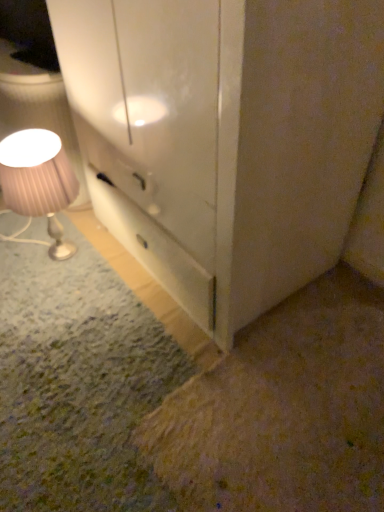
Where is `pink pleated fabric lampshade at left`? This screenshot has height=512, width=384. pink pleated fabric lampshade at left is located at coordinates (38, 181).

What is the approximate height of pink pleated fabric lampshade at left?

pink pleated fabric lampshade at left is 18.29 inches in height.

What do you see at coordinates (38, 181) in the screenshot?
I see `pink pleated fabric lampshade at left` at bounding box center [38, 181].

This screenshot has height=512, width=384. In order to click on pink pleated fabric lampshade at left in this screenshot , I will do `click(38, 181)`.